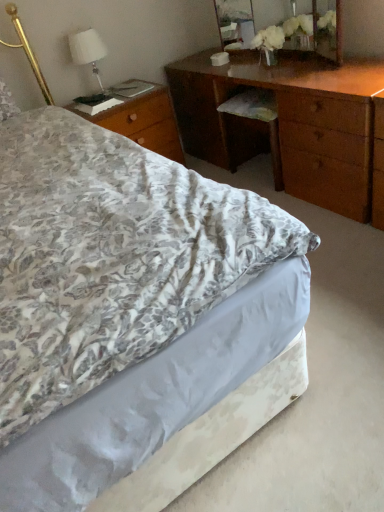
Question: From a real-world perspective, is wooden mirror at upper center positioned above or below wooden nightstand at left?

Choices:
 (A) above
 (B) below

Answer: (A)

Question: Is point (231, 35) closer or farther from the camera than point (157, 100)?

Choices:
 (A) farther
 (B) closer

Answer: (A)

Question: Which of these objects is positioned farthest from the white fabric lampshade at upper left?

Choices:
 (A) wooden nightstand at left
 (B) wooden desk at center
 (C) wooden mirror at upper center
 (D) floral fabric bed at center

Answer: (D)

Question: Which is farther from the wooden nightstand at left?

Choices:
 (A) floral fabric bed at center
 (B) wooden mirror at upper center
 (C) wooden desk at center
 (D) white fabric lampshade at upper left

Answer: (A)